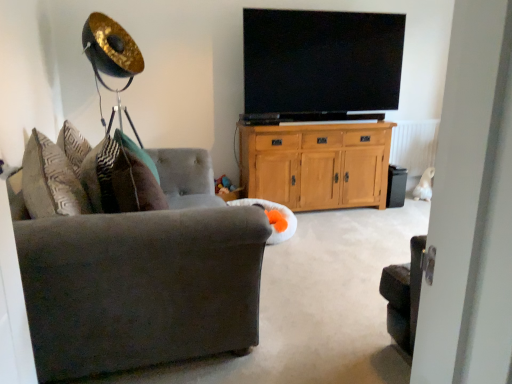
Question: Is flat-screen tv at upper center aimed at green fabric pillow at left?

Choices:
 (A) no
 (B) yes

Answer: (A)

Question: Considering the relative positions of flat-screen tv at upper center and green fabric pillow at left in the image provided, is flat-screen tv at upper center behind green fabric pillow at left?

Choices:
 (A) no
 (B) yes

Answer: (B)

Question: Is green fabric pillow at left located within flat-screen tv at upper center?

Choices:
 (A) yes
 (B) no

Answer: (B)

Question: Is flat-screen tv at upper center in front of green fabric pillow at left?

Choices:
 (A) no
 (B) yes

Answer: (A)

Question: From a real-world perspective, is flat-screen tv at upper center physically below green fabric pillow at left?

Choices:
 (A) yes
 (B) no

Answer: (B)

Question: Can you confirm if flat-screen tv at upper center is wider than green fabric pillow at left?

Choices:
 (A) yes
 (B) no

Answer: (B)

Question: Is velvet gray couch at left positioned behind flat-screen tv at upper center?

Choices:
 (A) no
 (B) yes

Answer: (A)

Question: Does velvet gray couch at left touch flat-screen tv at upper center?

Choices:
 (A) no
 (B) yes

Answer: (A)

Question: From the image's perspective, does velvet gray couch at left appear lower than flat-screen tv at upper center?

Choices:
 (A) yes
 (B) no

Answer: (A)

Question: Is the depth of velvet gray couch at left less than that of flat-screen tv at upper center?

Choices:
 (A) no
 (B) yes

Answer: (B)

Question: Is velvet gray couch at left thinner than flat-screen tv at upper center?

Choices:
 (A) no
 (B) yes

Answer: (A)

Question: Does velvet gray couch at left appear on the right side of flat-screen tv at upper center?

Choices:
 (A) yes
 (B) no

Answer: (B)

Question: From a real-world perspective, is light oak cabinet at center beneath flat-screen tv at upper center?

Choices:
 (A) no
 (B) yes

Answer: (B)